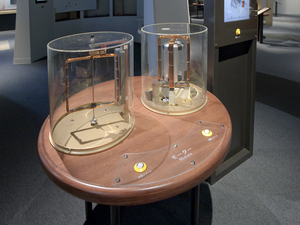
This screenshot has height=225, width=300. Identify the location of table. (144, 144).